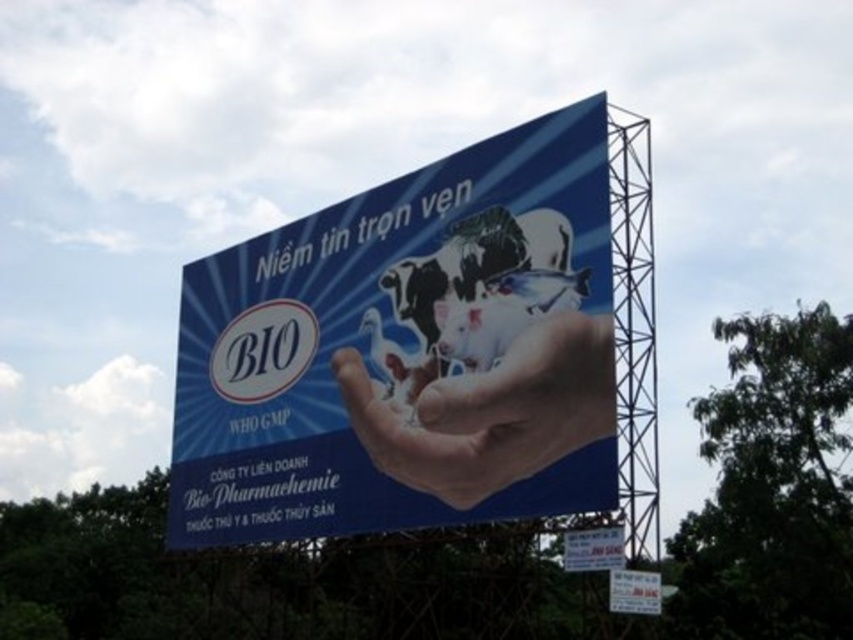
Is blue matte billboard at center wider than smooth skin hand at center?

Yes, blue matte billboard at center is wider than smooth skin hand at center.

Looking at this image, does blue matte billboard at center come behind smooth skin hand at center?

No.

Does point (592, 502) lie behind point (509, 372)?

No, it is in front of (509, 372).

You are a GUI agent. You are given a task and a screenshot of the screen. Output one action in this format:
    pyautogui.click(x=<x>, y=<y>)
    Task: Click on the blue matte billboard at center
    The width and height of the screenshot is (853, 640).
    Given the screenshot: What is the action you would take?
    pyautogui.click(x=407, y=352)